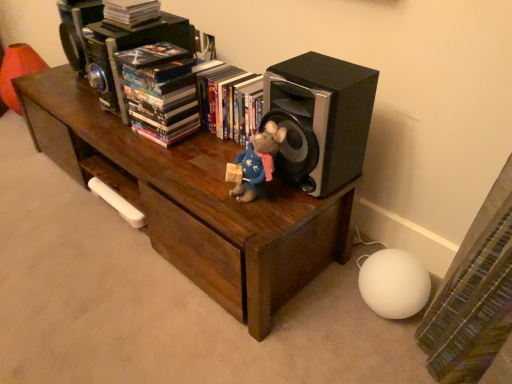
The height and width of the screenshot is (384, 512). I want to click on free space that is to the left of multicolored paperbacks at upper center, positioned as the second book in right-to-left order, so [113, 133].